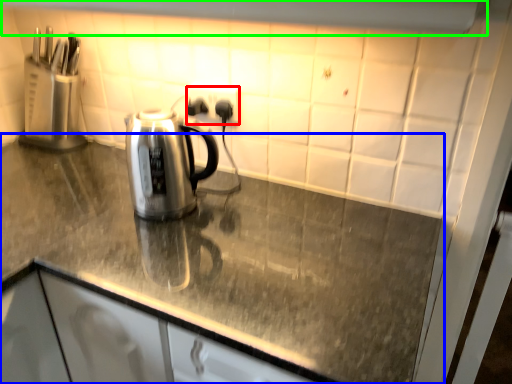
Question: Considering the real-world distances, which object is closest to electric outlet (highlighted by a red box)? countertop (highlighted by a blue box) or exhaust hood (highlighted by a green box).

Choices:
 (A) countertop
 (B) exhaust hood

Answer: (B)